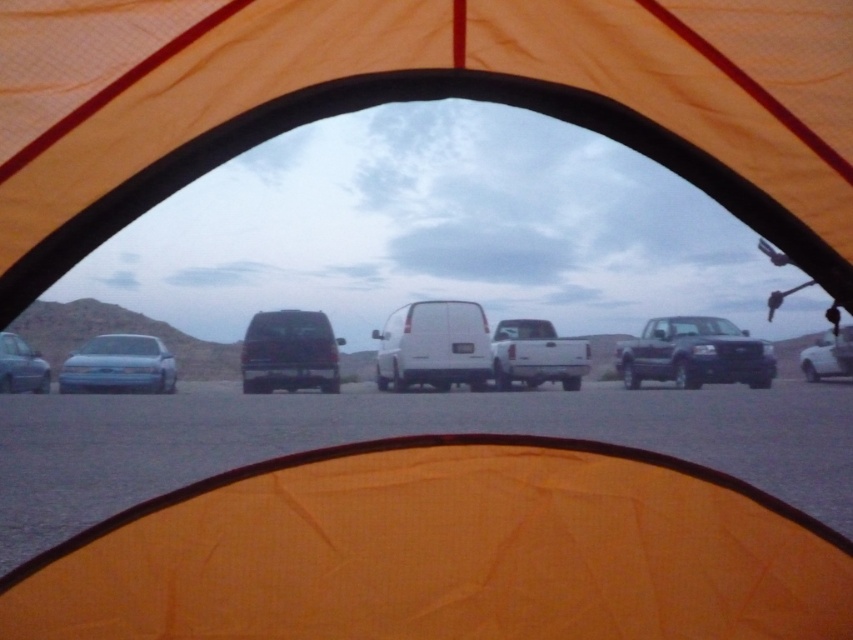
You are standing inside the tent and want to find the dark gray matte van at center. Based on the coordinates provided, can you determine its position relative to the other vehicles outside?

The dark gray matte van at center is located at coordinates (289, 353), which places it in the center of the scene. Since it is at the center, it is positioned between the vehicles to its left and right.

You are planning to park your compact car, which is 1.7 meters wide, between the dark gray matte van at center and the matte blue sedan at left. Based on their widths, will there be enough space for your car to fit between them?

The dark gray matte van at center has a lesser width compared to matte blue sedan at left. Since the van is narrower than the sedan, the space between them might be sufficient for your 1.7 meter wide car, but exact spacing isn

From the picture: You are inside the tent and want to know which of the two points, point (x=299, y=353) or point (x=112, y=336), is closer to you. Based on the scene description, which point is nearer?

Result: Point (x=299, y=353) is closer to the viewer than point (x=112, y=336).